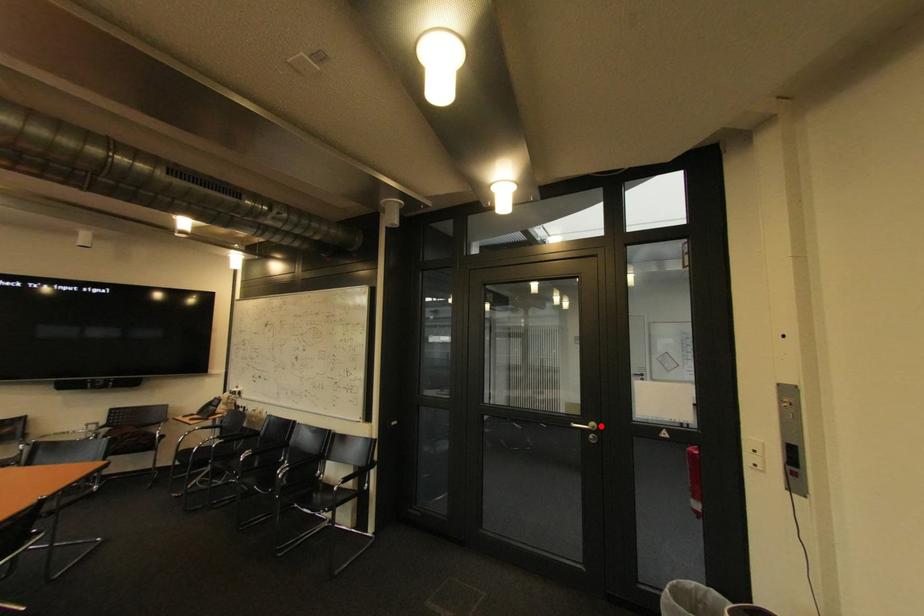
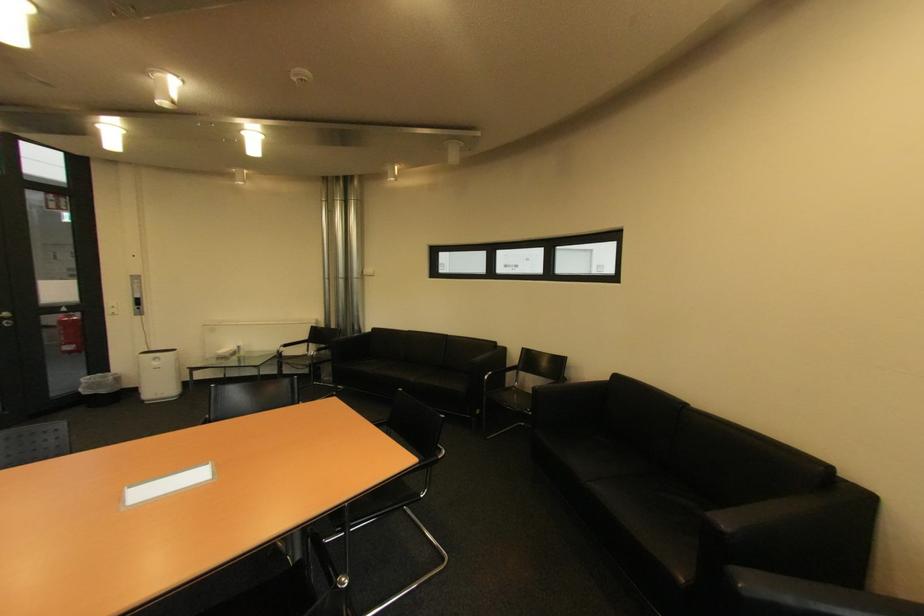
In the second image, find the point that corresponds to the highlighted location in the first image.

(14, 315)